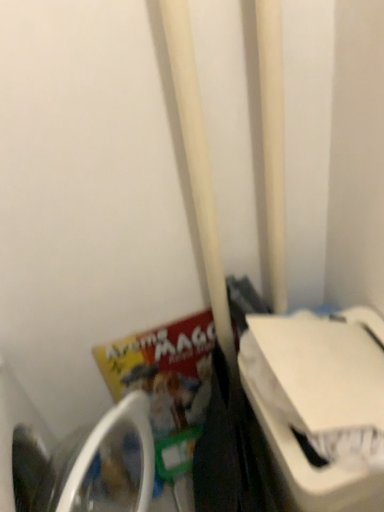
Question: From the image's perspective, is white matte pole at center located above or below white plastic washing machine at right, which ranks as the 1th washing machine in right-to-left order?

Choices:
 (A) above
 (B) below

Answer: (A)

Question: Is white matte pole at center taller or shorter than white plastic washing machine at right, which ranks as the 1th washing machine in right-to-left order?

Choices:
 (A) short
 (B) tall

Answer: (B)

Question: Estimate the real-world distances between objects in this image. Which object is farther from the white plastic washing machine at right, which ranks as the 1th washing machine in right-to-left order?

Choices:
 (A) white matte pole at center
 (B) white plastic washing machine at lower left, arranged as the second washing machine when viewed from the right
 (C) matte paper book at lower left

Answer: (B)

Question: Considering the real-world distances, which object is farthest from the white matte pole at center?

Choices:
 (A) matte paper book at lower left
 (B) white plastic washing machine at right, which ranks as the 1th washing machine in right-to-left order
 (C) white plastic washing machine at lower left, which appears as the 1th washing machine when viewed from the left

Answer: (C)